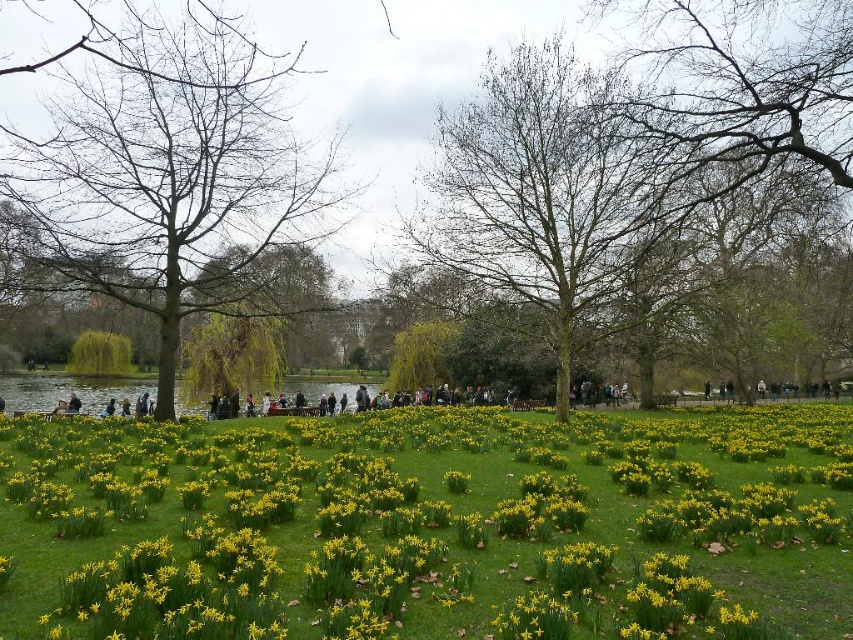
Between yellow grass at center and bare wood tree at left, which one is positioned higher?

bare wood tree at left is higher up.

Which is below, yellow grass at center or bare wood tree at left?

yellow grass at center is lower down.

The image size is (853, 640). I want to click on yellow grass at center, so click(428, 525).

Can you confirm if yellow grass at center is smaller than bare branches at center?

Yes, yellow grass at center is smaller than bare branches at center.

Image resolution: width=853 pixels, height=640 pixels. What do you see at coordinates (428, 525) in the screenshot? I see `yellow grass at center` at bounding box center [428, 525].

This screenshot has height=640, width=853. I want to click on yellow grass at center, so click(x=428, y=525).

Who is taller, bare branches at center or bare wood tree at left?

bare branches at center is taller.

I want to click on bare branches at center, so coord(613,168).

At what (x,y) coordinates should I click in order to perform the action: click on bare branches at center. Please return your answer as a coordinate pair (x, y). This screenshot has width=853, height=640. Looking at the image, I should click on (613, 168).